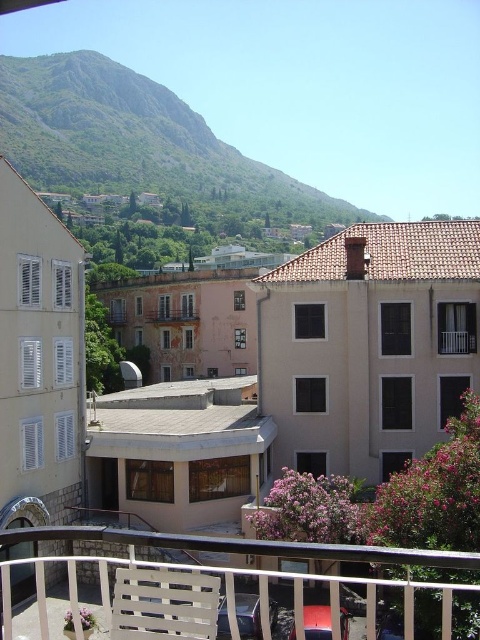
In order to click on white plastic chair at lower center in this screenshot , I will do `click(164, 604)`.

Which of these two, white plastic chair at lower center or white wooden balcony at lower right, stands taller?

white wooden balcony at lower right is taller.

You are a GUI agent. You are given a task and a screenshot of the screen. Output one action in this format:
    pyautogui.click(x=<x>, y=<y>)
    Task: Click on the white plastic chair at lower center
    The height and width of the screenshot is (640, 480).
    Given the screenshot: What is the action you would take?
    pyautogui.click(x=164, y=604)

Who is positioned more to the right, white plastic chair at lower center or brown wooden balcony at center?

Positioned to the right is white plastic chair at lower center.

Is white plastic chair at lower center to the left of brown wooden balcony at center from the viewer's perspective?

Incorrect, white plastic chair at lower center is not on the left side of brown wooden balcony at center.

Is point (195, 628) closer to camera compared to point (193, 310)?

Yes, it is in front of point (193, 310).

Locate an element on the screen. white plastic chair at lower center is located at coordinates (164, 604).

Which of these two, white wooden balcony at lower right or brown wooden balcony at center, stands shorter?

brown wooden balcony at center is shorter.

Can you confirm if white wooden balcony at lower right is positioned to the left of brown wooden balcony at center?

Incorrect, white wooden balcony at lower right is not on the left side of brown wooden balcony at center.

This screenshot has width=480, height=640. I want to click on white wooden balcony at lower right, so click(456, 340).

The height and width of the screenshot is (640, 480). Identify the location of white wooden balcony at lower right. (456, 340).